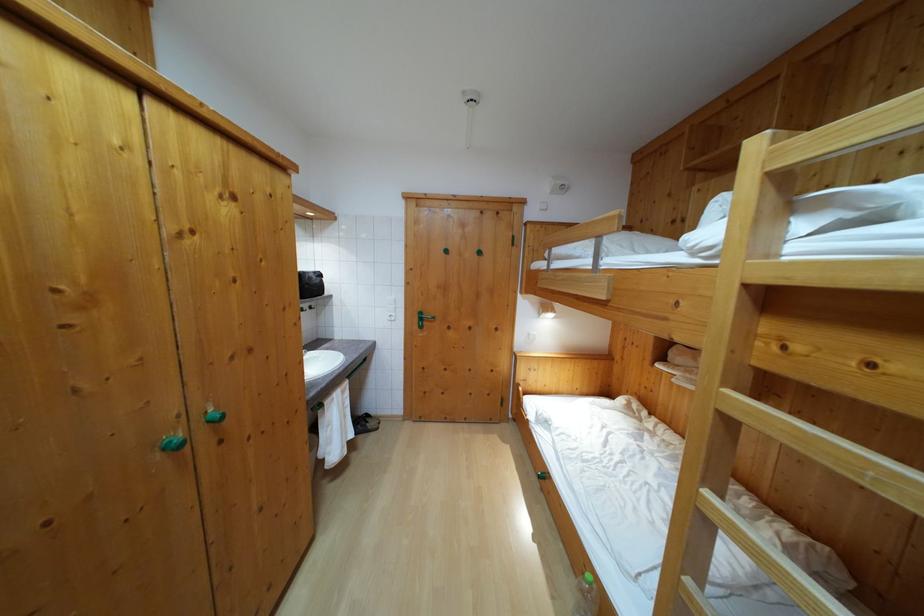
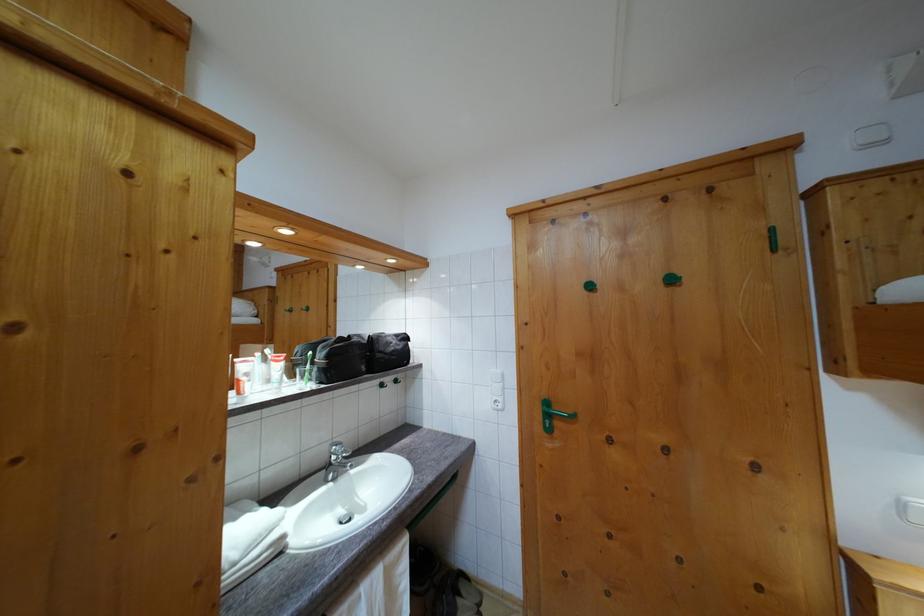
Locate, in the second image, the point that corresponds to pixel 319 280 in the first image.

(400, 342)